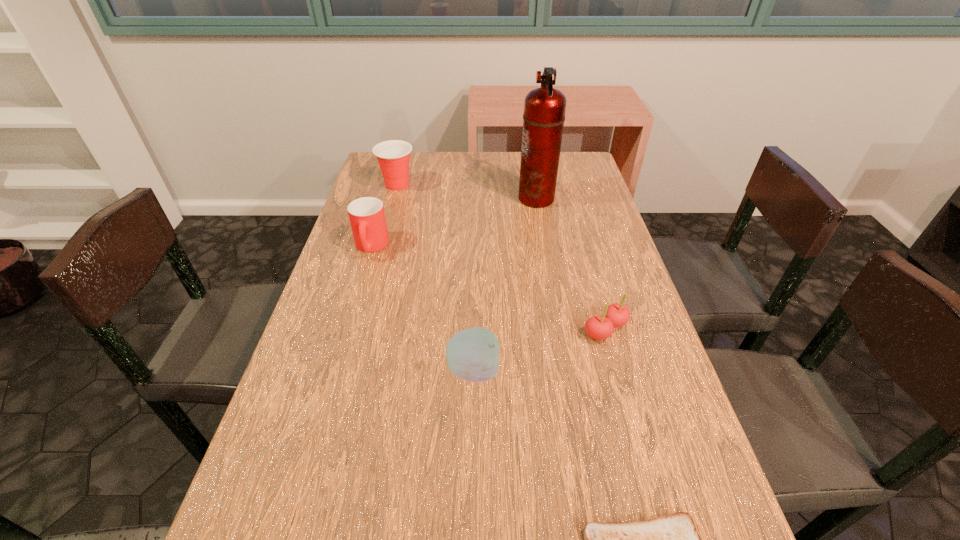
Image resolution: width=960 pixels, height=540 pixels. In order to click on the tallest object in this screenshot , I will do `click(544, 109)`.

What are the coordinates of `the farther cup` in the screenshot? It's located at (393, 156).

Find the location of a particular element. This screenshot has height=540, width=960. the nearer cup is located at coordinates (367, 218).

The width and height of the screenshot is (960, 540). Find the location of `apple`. apple is located at coordinates (472, 354).

Where is `the third object from left to right`? This screenshot has width=960, height=540. the third object from left to right is located at coordinates (472, 354).

At what (x,y) coordinates should I click in order to perform the action: click on the fifth tallest object. Please return your answer as a coordinate pair (x, y). Looking at the image, I should click on (615, 315).

This screenshot has height=540, width=960. I want to click on the third nearest object, so click(615, 315).

Locate an element on the screen. The image size is (960, 540). vacant region located 0.380m on the side of the fire extinguisher with the handle and hose is located at coordinates (398, 198).

What are the coordinates of `vacant space located 0.210m on the side of the fire extinguisher with the handle and hose` in the screenshot? It's located at (451, 198).

Find the location of a particular element. This screenshot has width=960, height=540. free spot located 0.270m on the side of the fire extinguisher with the handle and hose is located at coordinates (433, 198).